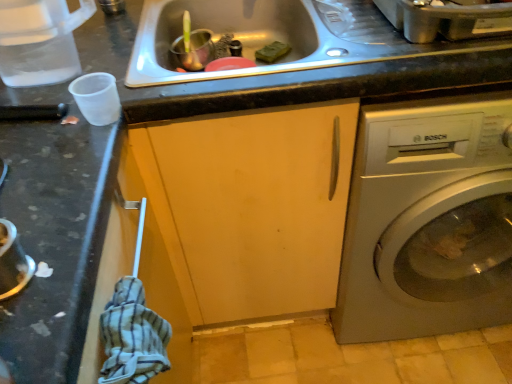
Question: Do you think stainless steel sink at center is within transparent plastic cup at left, or outside of it?

Choices:
 (A) outside
 (B) inside

Answer: (A)

Question: Does point [x=228, y=8] appear closer or farther from the camera than point [x=26, y=18]?

Choices:
 (A) closer
 (B) farther

Answer: (B)

Question: Which is nearer to the matte wood cabinet at center?

Choices:
 (A) stainless steel sink at center
 (B) transparent plastic cup at left
 (C) satin silver washing machine at right

Answer: (C)

Question: Estimate the real-world distances between objects in this image. Which object is closer to the transparent plastic cup at left?

Choices:
 (A) stainless steel sink at center
 (B) satin silver washing machine at right
 (C) matte wood cabinet at center

Answer: (A)